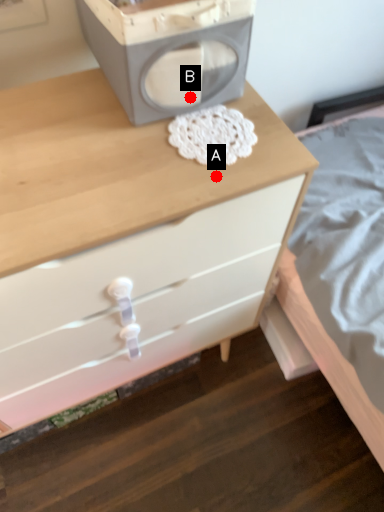
Question: Two points are circled on the image, labeled by A and B beside each circle. Among these points, which one is nearest to the camera?

Choices:
 (A) A is closer
 (B) B is closer

Answer: (A)